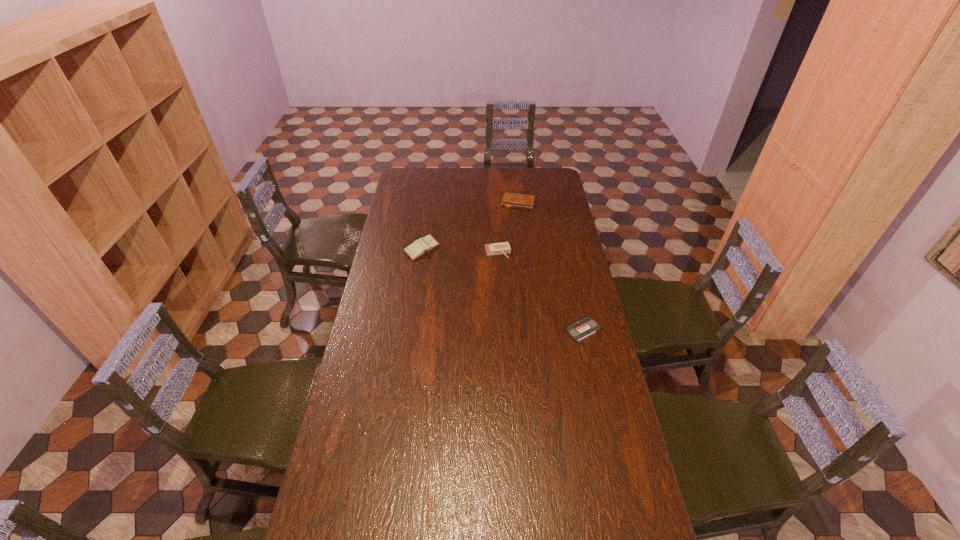
Locate an element on the screen. This screenshot has width=960, height=540. the taller diary is located at coordinates (419, 247).

Image resolution: width=960 pixels, height=540 pixels. In order to click on the left diary in this screenshot , I will do `click(419, 247)`.

I want to click on the shortest object, so click(587, 326).

This screenshot has height=540, width=960. What are the coordinates of `the rightmost object` in the screenshot? It's located at (587, 326).

The image size is (960, 540). Find the location of `the shorter diary`. the shorter diary is located at coordinates (512, 200).

Identify the location of the farther diary. The height and width of the screenshot is (540, 960). (512, 200).

This screenshot has height=540, width=960. Find the location of `the second tallest object`. the second tallest object is located at coordinates (496, 248).

At what (x,y) coordinates should I click in order to perform the action: click on free space located on the back of the taller diary. Please return your answer as a coordinate pair (x, y). Looking at the image, I should click on (427, 215).

At what (x,y) coordinates should I click in order to perform the action: click on vacant space located on the back of the shortest object. Please return your answer as a coordinate pair (x, y). Image resolution: width=960 pixels, height=540 pixels. Looking at the image, I should click on (569, 273).

You are a GUI agent. You are given a task and a screenshot of the screen. Output one action in this format:
    pyautogui.click(x=<x>, y=<y>)
    Task: Click on the vacant area situated 0.340m on the spine side of the farther diary
    Image resolution: width=960 pixels, height=540 pixels.
    Given the screenshot: What is the action you would take?
    pyautogui.click(x=504, y=251)